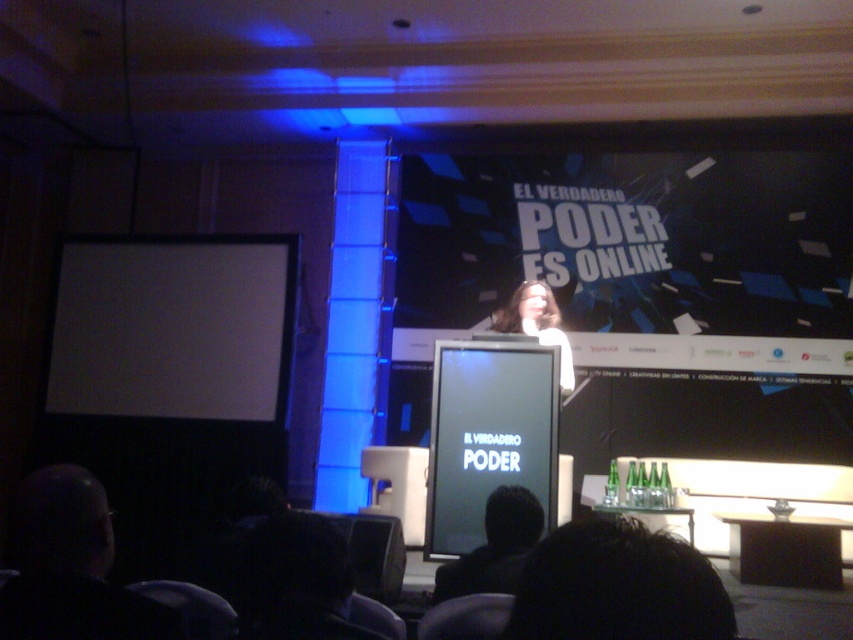
You are an event organizer trying to set up a camera to capture the speaker. The speaker has dark hair at lower left. Where should you position the camera to best capture the speaker?

The dark hair at lower left is located at point (73, 568), so position the camera to focus on that coordinate to best capture the speaker.

You are an event coordinator checking the stage setup. You notice the black glossy projection screen at center and the dark hair at lower left. Based on their positions, which object is closer to the front of the stage?

The dark hair at lower left is closer to the front of the stage because the black glossy projection screen at center is positioned below it, indicating it is further back.

You are an event planner setting up a presentation. You need to position a new projector so it faces the white matte projection screen at left. Given that the screen is located at coordinates point [173,326], where should you place the projector to ensure it faces the correct direction?

The projector should be placed facing the white matte projection screen at left located at coordinates point [173,326] to ensure proper alignment.